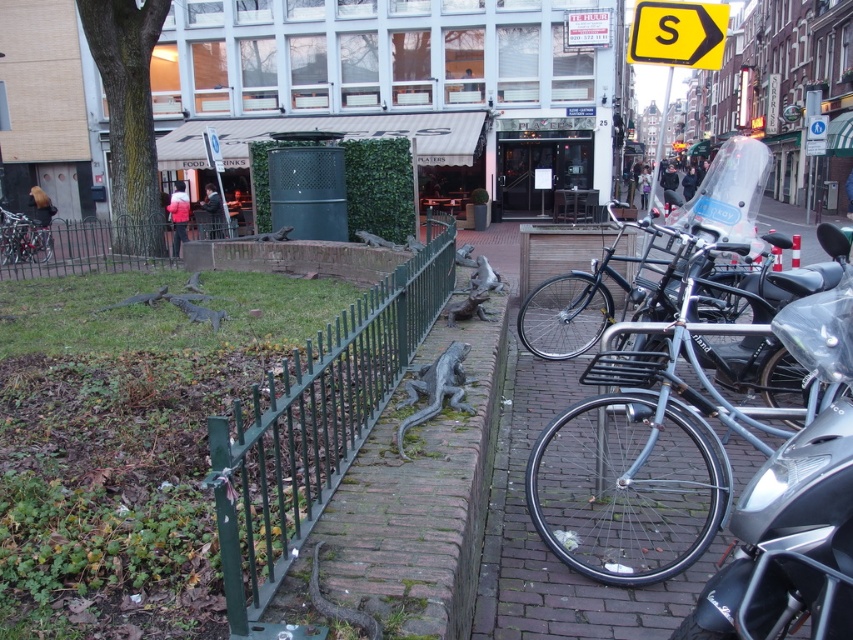
Question: Can you confirm if metallic silver bicycle at right is smaller than shiny metallic bicycle at left?

Choices:
 (A) no
 (B) yes

Answer: (A)

Question: Does shiny silver motorcycle at right appear on the left side of green metal fence at left?

Choices:
 (A) yes
 (B) no

Answer: (B)

Question: Does shiny silver motorcycle at right have a greater width compared to green metal fence at left?

Choices:
 (A) no
 (B) yes

Answer: (A)

Question: Which point appears closest to the camera in this image?

Choices:
 (A) (583, 273)
 (B) (593, 621)
 (C) (171, 236)

Answer: (B)

Question: Among these points, which one is farthest from the camera?

Choices:
 (A) (822, 556)
 (B) (512, 577)
 (C) (409, 308)
 (D) (51, 240)

Answer: (D)

Question: Which object appears closest to the camera in this image?

Choices:
 (A) green metal fence at left
 (B) shiny silver motorcycle at right
 (C) shiny metallic bicycle at left
 (D) metallic silver bicycle at right

Answer: (B)